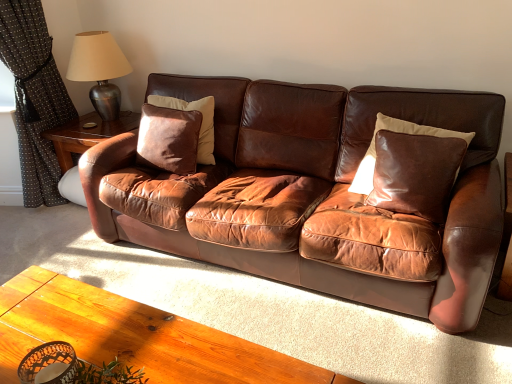
Question: Is point (369, 150) positioned closer to the camera than point (99, 44)?

Choices:
 (A) closer
 (B) farther

Answer: (A)

Question: From the image's perspective, is shiny brown leather pillow at right, acting as the first pillow starting from the right, positioned above or below metallic silver table lamp at upper left?

Choices:
 (A) above
 (B) below

Answer: (B)

Question: Based on their relative distances, which object is nearer to the metallic silver table lamp at upper left?

Choices:
 (A) black dotted fabric at left
 (B) suede-like brown pillow at center-left, acting as the 1th pillow starting from the left
 (C) brown leather couch at center
 (D) shiny brown leather pillow at right, which ranks as the 2th pillow in left-to-right order

Answer: (A)

Question: Estimate the real-world distances between objects in this image. Which object is closer to the shiny brown leather pillow at right, acting as the first pillow starting from the right?

Choices:
 (A) metallic silver table lamp at upper left
 (B) black dotted fabric at left
 (C) brown leather couch at center
 (D) suede-like brown pillow at center-left, acting as the 1th pillow starting from the left

Answer: (C)